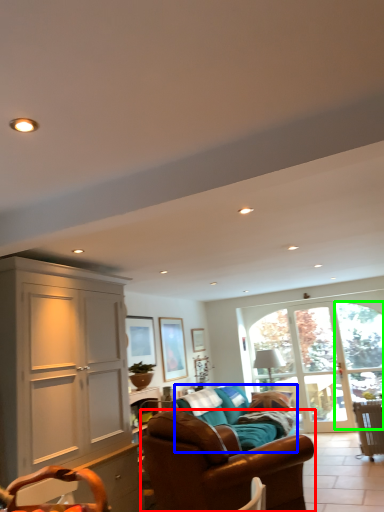
Question: Based on their relative distances, which object is farther from studio couch (highlighted by a red box)? Choose from studio couch (highlighted by a blue box) and window (highlighted by a green box).

Choices:
 (A) studio couch
 (B) window

Answer: (B)